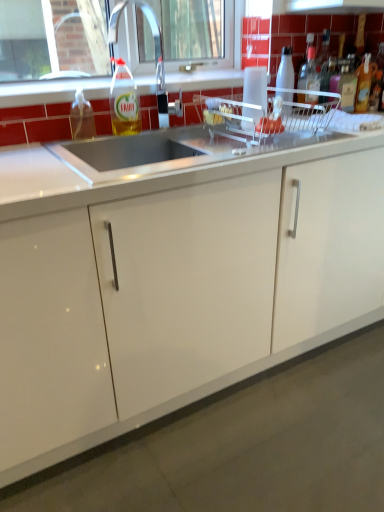
Measure the distance between point [132,96] and camera.

The distance of point [132,96] from camera is 1.52 meters.

The image size is (384, 512). Describe the element at coordinates (285, 70) in the screenshot. I see `white glossy bottle at upper right, placed as the third bottle when sorted from left to right` at that location.

Describe the element at coordinates (270, 111) in the screenshot. I see `satin steel sink at upper center` at that location.

The image size is (384, 512). What are the coordinates of `clear glass window at upper center` in the screenshot? It's located at (51, 91).

What do you see at coordinates (318, 66) in the screenshot?
I see `translucent plastic bottle at upper right, marked as the 5th bottle in a left-to-right arrangement` at bounding box center [318, 66].

What is the approximate width of translucent plastic bottle at upper right, the second bottle positioned from the right?

It is 2.50 inches.

Image resolution: width=384 pixels, height=512 pixels. What do you see at coordinates (268, 116) in the screenshot? I see `clear plastic dish rack at center` at bounding box center [268, 116].

Where is `translucent plastic bottle at upper center, which appears as the 5th bottle when viewed from the right`? translucent plastic bottle at upper center, which appears as the 5th bottle when viewed from the right is located at coordinates (124, 101).

From the image's perspective, which one is positioned lower, translucent plastic bottle at upper right, which is the 3th bottle from right to left, or white glossy bottle at upper right, placed as the third bottle when sorted from left to right?

white glossy bottle at upper right, placed as the third bottle when sorted from left to right.

Can we say translucent plastic bottle at upper right, which is the 3th bottle from right to left, lies outside white glossy bottle at upper right, the fourth bottle when ordered from right to left?

Yes.

Could you tell me if translucent plastic bottle at upper right, which is the 4th bottle from left to right, is turned towards white glossy bottle at upper right, placed as the third bottle when sorted from left to right?

No, translucent plastic bottle at upper right, which is the 4th bottle from left to right, is not aimed at white glossy bottle at upper right, placed as the third bottle when sorted from left to right.

Between translucent plastic bottle at upper right, which is the 4th bottle from left to right, and white glossy bottle at upper right, the fourth bottle when ordered from right to left, which one appears on the right side from the viewer's perspective?

translucent plastic bottle at upper right, which is the 4th bottle from left to right, is more to the right.

Considering the positions of objects white glossy countertop at center, the second countertop positioned from the bottom, and satin steel sink at upper center in the image provided, who is behind, white glossy countertop at center, the second countertop positioned from the bottom, or satin steel sink at upper center?

satin steel sink at upper center is behind.

Considering the relative sizes of white glossy countertop at center, the second countertop positioned from the bottom, and satin steel sink at upper center in the image provided, is white glossy countertop at center, the second countertop positioned from the bottom, taller than satin steel sink at upper center?

No, white glossy countertop at center, the second countertop positioned from the bottom, is not taller than satin steel sink at upper center.

Which of these two, white glossy countertop at center, the second countertop positioned from the bottom, or satin steel sink at upper center, is bigger?

Bigger between the two is white glossy countertop at center, the second countertop positioned from the bottom.

Considering the positions of point (312, 143) and point (193, 76), is point (312, 143) closer or farther from the camera than point (193, 76)?

Clearly, point (312, 143) is closer to the camera than point (193, 76).

Identify the location of window lying above the white glossy countertop at center, which appears as the 1th countertop when viewed from the top (from the image's perspective). (51, 91).

Is white glossy countertop at center, which appears as the 1th countertop when viewed from the top, facing towards clear glass window at upper center?

No.

From a real-world perspective, is white glossy countertop at center, the second countertop positioned from the bottom, positioned above or below clear glass window at upper center?

Clearly, from a real-world perspective, white glossy countertop at center, the second countertop positioned from the bottom, is below clear glass window at upper center.

Is translucent plastic soap dispenser at sink left, which appears as the 1th bottle when viewed from the left, facing towards translucent plastic bottle at upper right, the second bottle positioned from the right?

No, translucent plastic soap dispenser at sink left, which appears as the 1th bottle when viewed from the left, is not aimed at translucent plastic bottle at upper right, the second bottle positioned from the right.

Which point is more distant from viewer, (77, 91) or (328, 38)?

The point (328, 38) is more distant.

From the image's perspective, is translucent plastic bottle at upper right, which is the 4th bottle from left to right, located above or below translucent plastic bottle at upper right, marked as the 5th bottle in a left-to-right arrangement?

Based on their image positions, translucent plastic bottle at upper right, which is the 4th bottle from left to right, is located beneath translucent plastic bottle at upper right, marked as the 5th bottle in a left-to-right arrangement.

Is translucent plastic bottle at upper right, which is the 4th bottle from left to right, aimed at translucent plastic bottle at upper right, the second bottle positioned from the right?

No, translucent plastic bottle at upper right, which is the 4th bottle from left to right, is not facing towards translucent plastic bottle at upper right, the second bottle positioned from the right.

What's the angular difference between translucent plastic bottle at upper right, which is the 3th bottle from right to left, and translucent plastic bottle at upper right, marked as the 5th bottle in a left-to-right arrangement,'s facing directions?

0 degrees.

Is translucent plastic bottle at upper right, which is the 3th bottle from right to left, not close to translucent plastic bottle at upper right, marked as the 5th bottle in a left-to-right arrangement?

translucent plastic bottle at upper right, which is the 3th bottle from right to left, is near translucent plastic bottle at upper right, marked as the 5th bottle in a left-to-right arrangement, not far away.

Who is smaller, translucent plastic bottle at upper right, the second bottle positioned from the right, or white glossy bottle at upper right, the fourth bottle when ordered from right to left?

translucent plastic bottle at upper right, the second bottle positioned from the right, is smaller.

From the image's perspective, which one is positioned higher, translucent plastic bottle at upper right, the second bottle positioned from the right, or white glossy bottle at upper right, placed as the third bottle when sorted from left to right?

translucent plastic bottle at upper right, the second bottle positioned from the right.

Which is closer, (324,89) or (278,95)?

The point (278,95) is closer.

Is translucent plastic bottle at upper right, marked as the 5th bottle in a left-to-right arrangement, not inside white glossy bottle at upper right, placed as the third bottle when sorted from left to right?

Yes.

Can you confirm if translucent plastic bottle at upper right, which is the 3th bottle from right to left, is smaller than clear plastic dish rack at center?

Yes.

Is translucent plastic bottle at upper right, which is the 3th bottle from right to left, to the left of clear plastic dish rack at center from the viewer's perspective?

In fact, translucent plastic bottle at upper right, which is the 3th bottle from right to left, is to the right of clear plastic dish rack at center.

Is translucent plastic bottle at upper right, which is the 4th bottle from left to right, facing towards clear plastic dish rack at center?

No, translucent plastic bottle at upper right, which is the 4th bottle from left to right, is not oriented towards clear plastic dish rack at center.

From the image's perspective, is translucent plastic bottle at upper right, which is the 4th bottle from left to right, under clear plastic dish rack at center?

No, from the image's perspective, translucent plastic bottle at upper right, which is the 4th bottle from left to right, is not beneath clear plastic dish rack at center.

Find the location of a particular element. the 1st bottle located above the white glossy bottle at upper right, the fourth bottle when ordered from right to left (from a real-world perspective) is located at coordinates (308, 66).

There is a satin steel sink at upper center. Where is `the 1st countertop below it (from the image's perspective)`? This screenshot has width=384, height=512. the 1st countertop below it (from the image's perspective) is located at coordinates (148, 165).

When comparing their distances from white glossy bottle at upper right, placed as the third bottle when sorted from left to right, does white glossy countertop at center, which appears as the 1th countertop when viewed from the top, or translucent plastic bottle at upper right, marked as the 5th bottle in a left-to-right arrangement, seem closer?

translucent plastic bottle at upper right, marked as the 5th bottle in a left-to-right arrangement.

From the image, which object appears to be farther from white glossy countertop at center, which appears as the 1th countertop when viewed from the top, translucent plastic bottle at upper center, which is counted as the second bottle, starting from the left, or translucent plastic container at upper center?

translucent plastic container at upper center lies further to white glossy countertop at center, which appears as the 1th countertop when viewed from the top, than the other object.

Based on their spatial positions, is translucent plastic bottle at upper right, the second bottle positioned from the right, or translucent plastic bottle at right, the sixth bottle from the left, further from translucent plastic container at upper center?

translucent plastic bottle at right, the sixth bottle from the left.

Estimate the real-world distances between objects in this image. Which object is closer to translucent plastic bottle at upper right, marked as the 5th bottle in a left-to-right arrangement, translucent plastic container at upper center or white glossy countertop at center, the second countertop positioned from the bottom?

translucent plastic container at upper center lies closer to translucent plastic bottle at upper right, marked as the 5th bottle in a left-to-right arrangement, than the other object.

From the image, which object appears to be nearer to clear plastic faucet at upper center, translucent plastic soap dispenser at sink left, which appears as the 1th bottle when viewed from the left, or translucent plastic container at upper center?

translucent plastic soap dispenser at sink left, which appears as the 1th bottle when viewed from the left, is positioned closer to the anchor clear plastic faucet at upper center.

From the picture: Looking at the image, which one is located further to clear glass window at upper center, translucent plastic bottle at upper right, which is the 4th bottle from left to right, or translucent plastic bottle at upper center, which is counted as the second bottle, starting from the left?

translucent plastic bottle at upper right, which is the 4th bottle from left to right, is further to clear glass window at upper center.

When comparing their distances from white glossy countertop at center, which is the 1th countertop from bottom to top, does translucent plastic bottle at upper right, which is the 3th bottle from right to left, or translucent plastic bottle at right, which ranks as the first bottle in right-to-left order, seem further?

translucent plastic bottle at right, which ranks as the first bottle in right-to-left order.

Looking at the image, which one is located closer to clear glass window at upper center, clear plastic faucet at upper center or translucent plastic bottle at upper right, the second bottle positioned from the right?

Among the two, clear plastic faucet at upper center is located nearer to clear glass window at upper center.

Image resolution: width=384 pixels, height=512 pixels. What are the coordinates of `appliance between clear plastic faucet at upper center and white glossy bottle at upper right, placed as the third bottle when sorted from left to right, from left to right` in the screenshot? It's located at coord(268,116).

Locate an element on the screen. Image resolution: width=384 pixels, height=512 pixels. window located between translucent plastic soap dispenser at sink left, which appears as the 1th bottle when viewed from the left, and white glossy bottle at upper right, the fourth bottle when ordered from right to left, in the left-right direction is located at coordinates (51, 91).

Where is `faucet that lies between clear glass window at upper center and translucent plastic soap dispenser at sink left, which appears as the 1th bottle when viewed from the left, from top to bottom`? Image resolution: width=384 pixels, height=512 pixels. faucet that lies between clear glass window at upper center and translucent plastic soap dispenser at sink left, which appears as the 1th bottle when viewed from the left, from top to bottom is located at coordinates (155, 52).

Where is `faucet located between translucent plastic soap dispenser at sink left, which appears as the 1th bottle when viewed from the left, and white glossy bottle at upper right, the fourth bottle when ordered from right to left, in the left-right direction`? faucet located between translucent plastic soap dispenser at sink left, which appears as the 1th bottle when viewed from the left, and white glossy bottle at upper right, the fourth bottle when ordered from right to left, in the left-right direction is located at coordinates (155, 52).